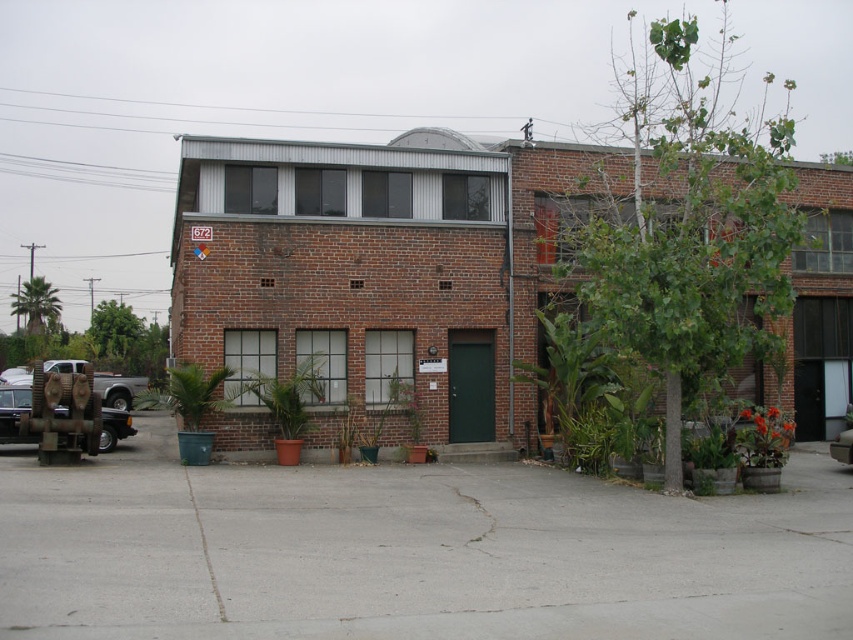
Does green matte plant at lower right appear on the right side of metallic silver car at center?

No, green matte plant at lower right is not to the right of metallic silver car at center.

Does point (776, 451) come behind point (828, 449)?

No, it is in front of (828, 449).

At what (x,y) coordinates should I click in order to perform the action: click on green matte plant at lower right. Please return your answer as a coordinate pair (x, y). The image size is (853, 640). Looking at the image, I should click on [762, 436].

Based on the photo, is rusty metal truck at lower left smaller than metallic silver car at center?

Yes, rusty metal truck at lower left is smaller than metallic silver car at center.

Which is behind, point (13, 387) or point (834, 445)?

The point (13, 387) is behind.

Locate an element on the screen. rusty metal truck at lower left is located at coordinates coord(15,413).

Can you confirm if green plastic pot at lower left is smaller than metallic silver car at center?

Incorrect, green plastic pot at lower left is not smaller in size than metallic silver car at center.

Which is more to the left, green plastic pot at lower left or metallic silver car at center?

green plastic pot at lower left is more to the left.

This screenshot has height=640, width=853. Find the location of `green plastic pot at lower left`. green plastic pot at lower left is located at coordinates (189, 406).